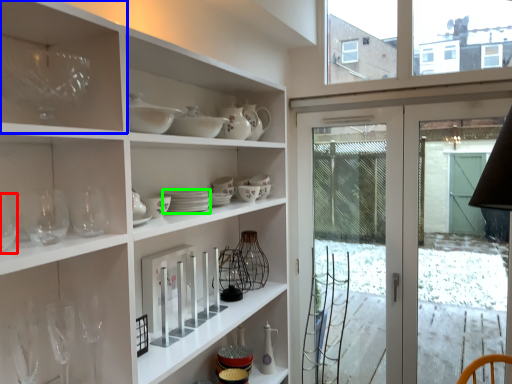
Question: Which object is positioned farthest from wine glass (highlighted by a red box)? Select from shelf (highlighted by a blue box) and tableware (highlighted by a green box).

Choices:
 (A) shelf
 (B) tableware

Answer: (B)